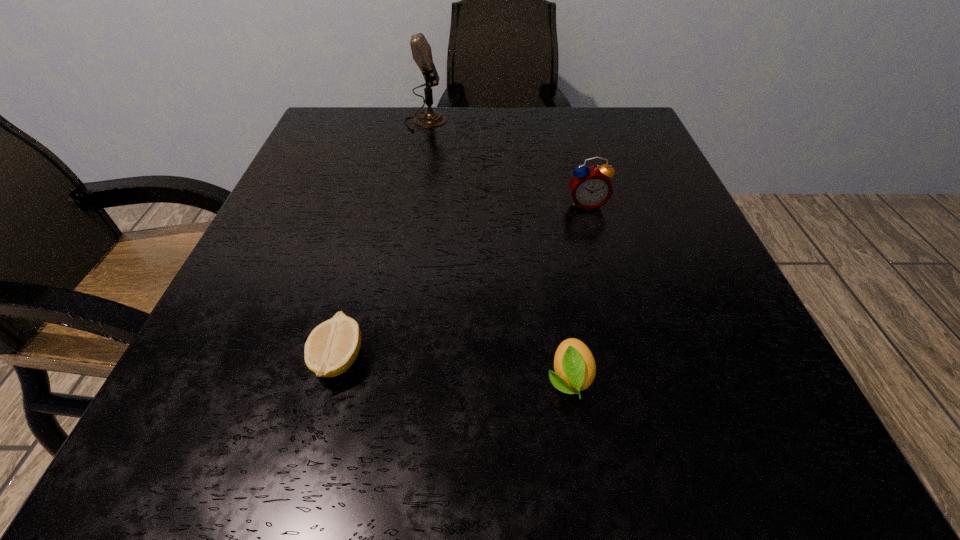
I want to click on free space located with leaves positioned above the taller lemon, so click(585, 480).

Locate an element on the screen. The height and width of the screenshot is (540, 960). vacant region located on the left of the shortest object is located at coordinates click(243, 359).

Identify the location of object located at the far edge. (421, 50).

In order to click on object that is at the left edge in this screenshot , I will do `click(332, 347)`.

The height and width of the screenshot is (540, 960). Find the location of `object located at the right edge`. object located at the right edge is located at coordinates (590, 187).

At what (x,y) coordinates should I click in order to perform the action: click on vacant area at the far edge. Please return your answer as a coordinate pair (x, y). This screenshot has width=960, height=540. Looking at the image, I should click on (491, 130).

Find the location of a particular element. This screenshot has width=960, height=540. vacant space at the near edge is located at coordinates (594, 443).

Where is `vacant space at the left edge`? This screenshot has height=540, width=960. vacant space at the left edge is located at coordinates (325, 265).

At what (x,y) coordinates should I click in order to perform the action: click on blank space at the right edge of the desktop. Please return your answer as a coordinate pair (x, y). The width and height of the screenshot is (960, 540). Looking at the image, I should click on (619, 181).

At what (x,y) coordinates should I click in order to perform the action: click on vacant space at the far left corner. Please return your answer as a coordinate pair (x, y). Looking at the image, I should click on (382, 128).